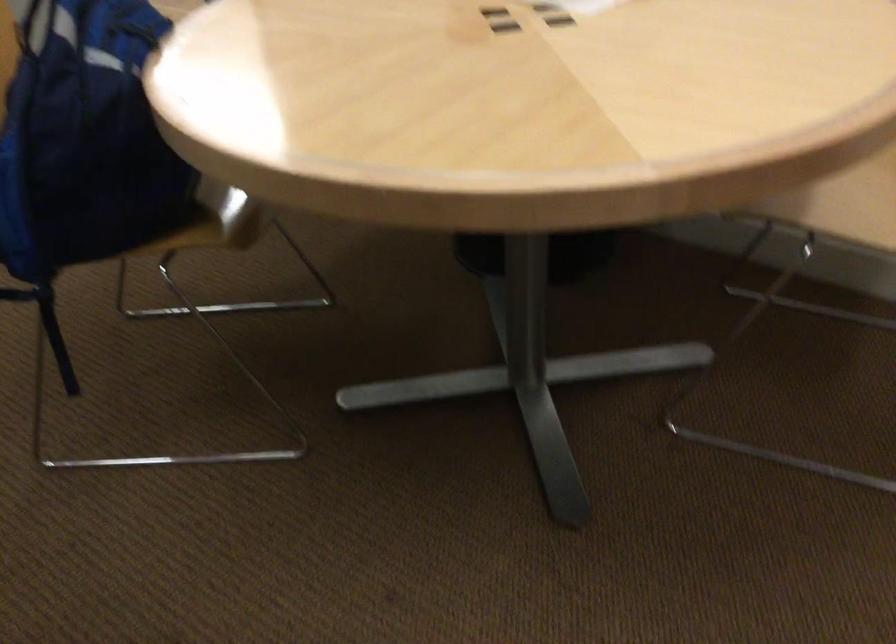
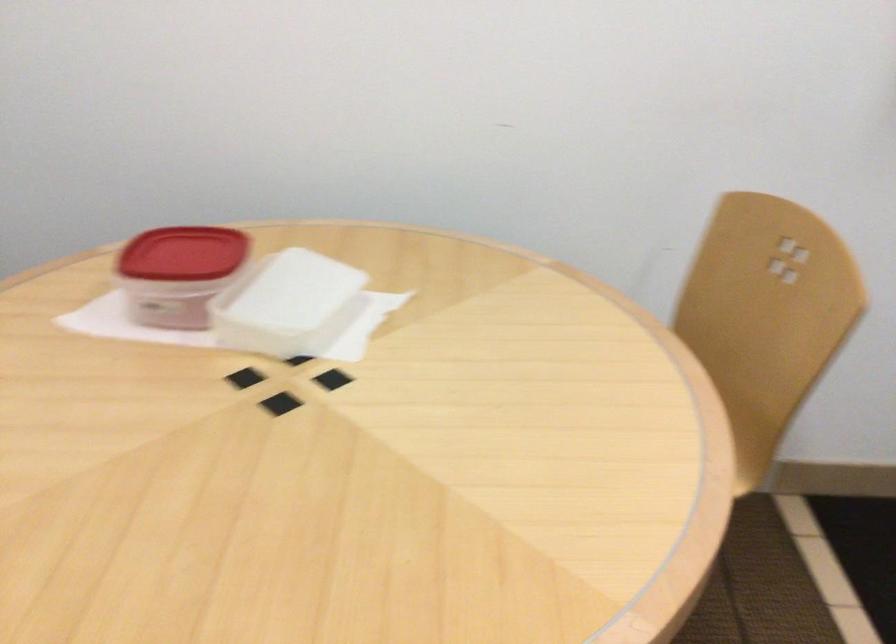
Question: Based on the continuous images, in which direction is the camera rotating? Reply with the corresponding letter.

Choices:
 (A) Left
 (B) Right
 (C) Up
 (D) Down

Answer: (B)